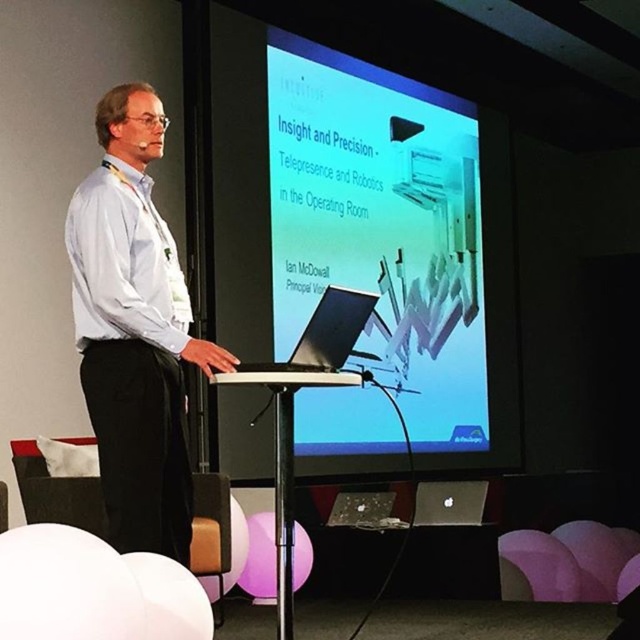
Question: Does light blue shirt at center have a smaller size compared to white plastic podium at center?

Choices:
 (A) no
 (B) yes

Answer: (A)

Question: Which point appears closest to the camera in this image?

Choices:
 (A) (173, 336)
 (B) (308, 384)
 (C) (365, 273)
 (D) (118, 360)

Answer: (D)

Question: Which of these objects is positioned closest to the sleek silver laptop at center?

Choices:
 (A) white smooth shirt at left
 (B) white glossy projector screen at upper center

Answer: (A)

Question: Does white smooth shirt at left come behind sleek silver laptop at center?

Choices:
 (A) no
 (B) yes

Answer: (A)

Question: Can you confirm if white glossy projector screen at upper center is bigger than white plastic podium at center?

Choices:
 (A) yes
 (B) no

Answer: (A)

Question: Which point appears farthest from the camera in this image?

Choices:
 (A) [172, 288]
 (B) [129, 440]
 (C) [337, 326]

Answer: (C)